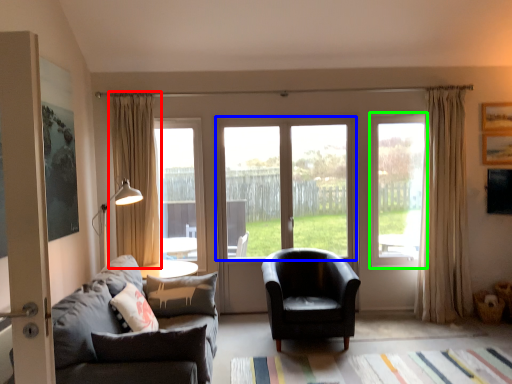
Question: Based on their relative distances, which object is nearer to curtain (highlighted by a red box)? Choose from window (highlighted by a blue box) and window (highlighted by a green box).

Choices:
 (A) window
 (B) window

Answer: (A)